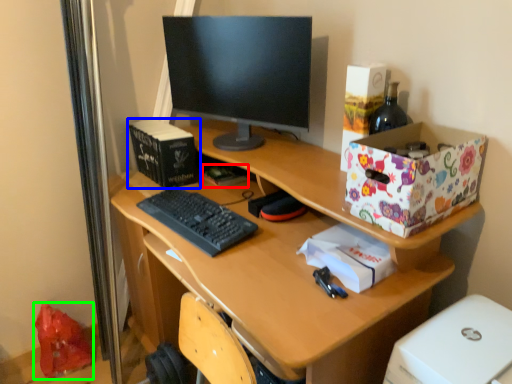
Question: Based on their relative distances, which object is nearer to book (highlighted by a red box)? Choose from book (highlighted by a blue box) and shopping bag (highlighted by a green box).

Choices:
 (A) book
 (B) shopping bag

Answer: (A)